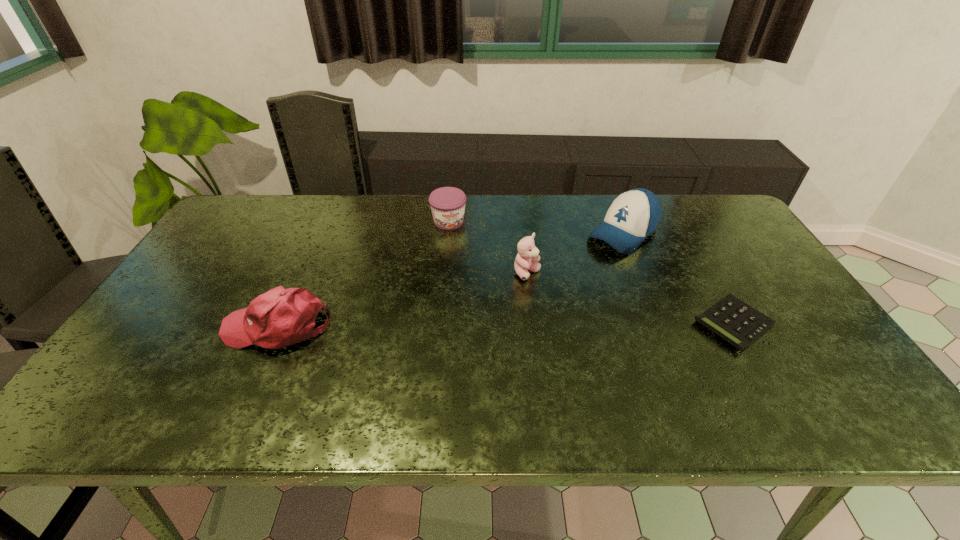
Locate an element on the screen. vacant space that is in between the jam and the leftmost object is located at coordinates (363, 274).

This screenshot has height=540, width=960. Identify the location of object that stands as the fourth closest to the calculator. (281, 317).

Identify which object is located as the second nearest to the leftmost object. Please provide its 2D coordinates. Your answer should be formatted as a tuple, i.e. [(x, y)], where the tuple contains the x and y coordinates of a point satisfying the conditions above.

[(527, 258)]

You are a GUI agent. You are given a task and a screenshot of the screen. Output one action in this format:
    pyautogui.click(x=<x>, y=<y>)
    Task: Click on the free space in the image that satisfies the following two spatial constraints: 1. on the front side of the second shortest object; 2. on the left side of the third nearest object
    
    Given the screenshot: What is the action you would take?
    pyautogui.click(x=444, y=273)